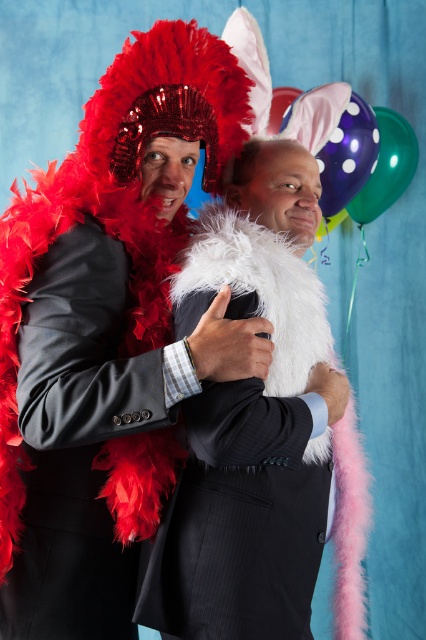
Based on the photo, you are standing at the camera position and want to throw a small ball to hit the point at coordinates point (x=247, y=419). If the ball travels in a straight line, will it pass through any of the two people in the image?

The distance of point (x=247, y=419) from camera is 3.29 feet. Since the two people are positioned between the camera and the point, the ball will pass through them.

You are at a party and see two purple balloons, the purple dotted balloon at upper center and the shiny purple balloon at upper right. Which balloon is more to the left?

The purple dotted balloon at upper center is more to the left.

You are at a party and want to take a photo of the white fluffy boa at center and the shiny purple balloon at upper right. Which object should you focus on first if you want to capture both in the frame without moving the camera?

You should focus on the white fluffy boa at center first because it is positioned to the left of the shiny purple balloon at upper right, so keeping it centered will allow the balloon to be captured on the right side of the frame.